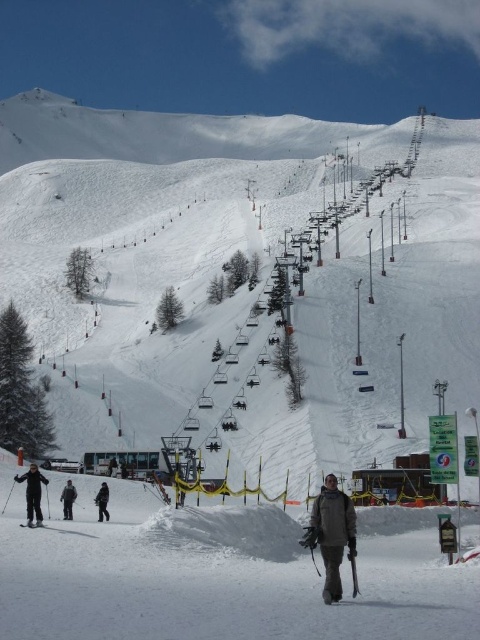
Question: Which object is the closest to the black matte ski at lower left?

Choices:
 (A) black matte skis at lower left
 (B) black matte snowboarder at lower left
 (C) dark gray jacket at lower center

Answer: (A)

Question: Observing the image, what is the correct spatial positioning of dark gray jacket at lower center in reference to black matte ski at lower left?

Choices:
 (A) above
 (B) below

Answer: (A)

Question: Considering the real-world distances, which object is farthest from the black matte snowboarder at lower left?

Choices:
 (A) black matte ski at lower left
 (B) dark gray jacket at lower center

Answer: (B)

Question: In this image, where is black matte jacket at lower left located relative to black matte snowboarder at lower left?

Choices:
 (A) right
 (B) left

Answer: (B)

Question: Is black matte skis at lower left smaller than black matte ski at lower left?

Choices:
 (A) no
 (B) yes

Answer: (A)

Question: Which point is farther to the camera?

Choices:
 (A) dark gray jacket at lower center
 (B) black matte snowboarder at lower left
 (C) black matte jacket at lower left
 (D) black matte skis at lower left

Answer: (B)